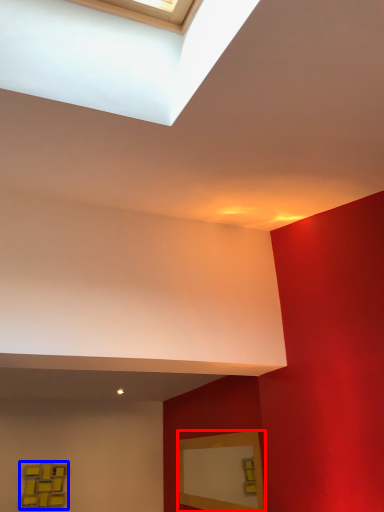
Question: Which object appears farthest to the camera in this image, picture frame (highlighted by a red box) or picture frame (highlighted by a blue box)?

Choices:
 (A) picture frame
 (B) picture frame

Answer: (B)